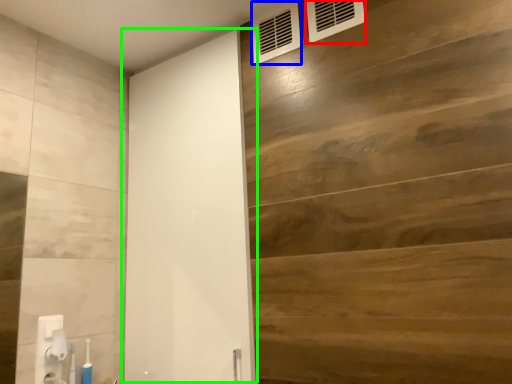
Question: Which object is positioned closest to air conditioning (highlighted by a red box)? Select from air conditioning (highlighted by a blue box) and barn door (highlighted by a green box).

Choices:
 (A) air conditioning
 (B) barn door

Answer: (A)